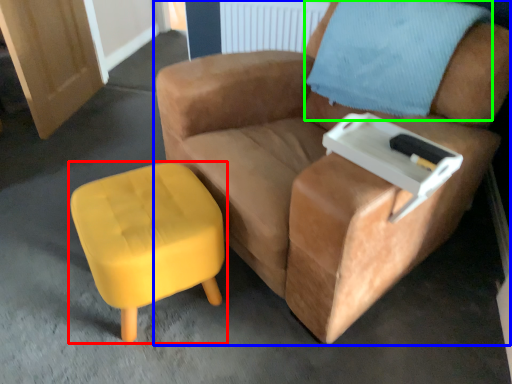
Question: Which object is positioned closest to stool (highlighted by a red box)? Select from chair (highlighted by a blue box) and pillow (highlighted by a green box).

Choices:
 (A) chair
 (B) pillow

Answer: (A)